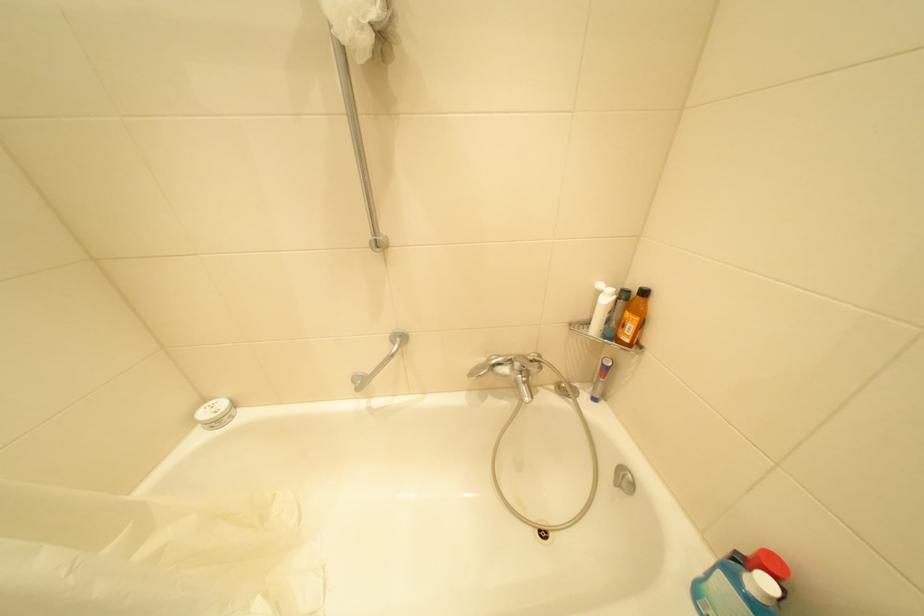
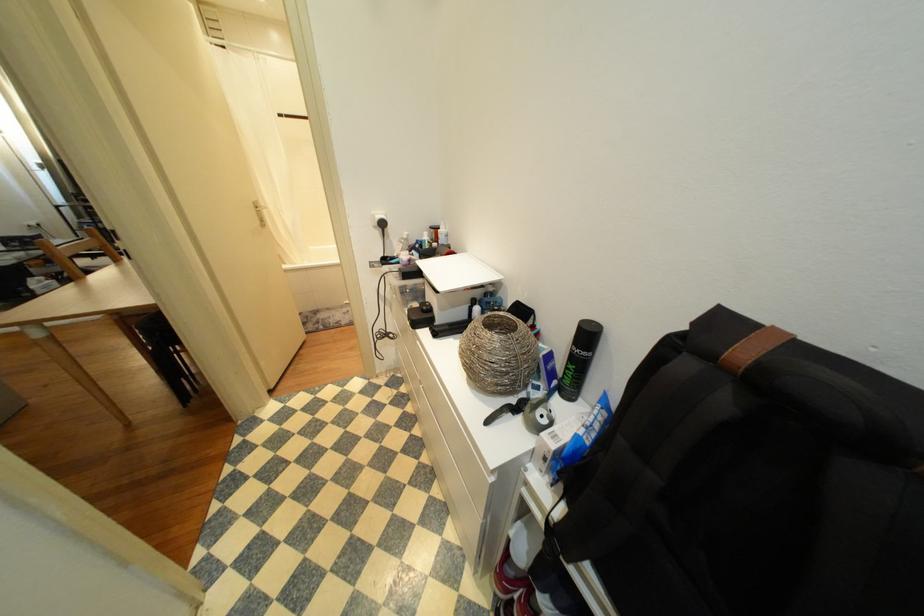
Question: Which direction would the cameraman need to move to produce the second image? Reply with the corresponding letter.

Choices:
 (A) Left
 (B) Right
 (C) Forward
 (D) Backward

Answer: (D)